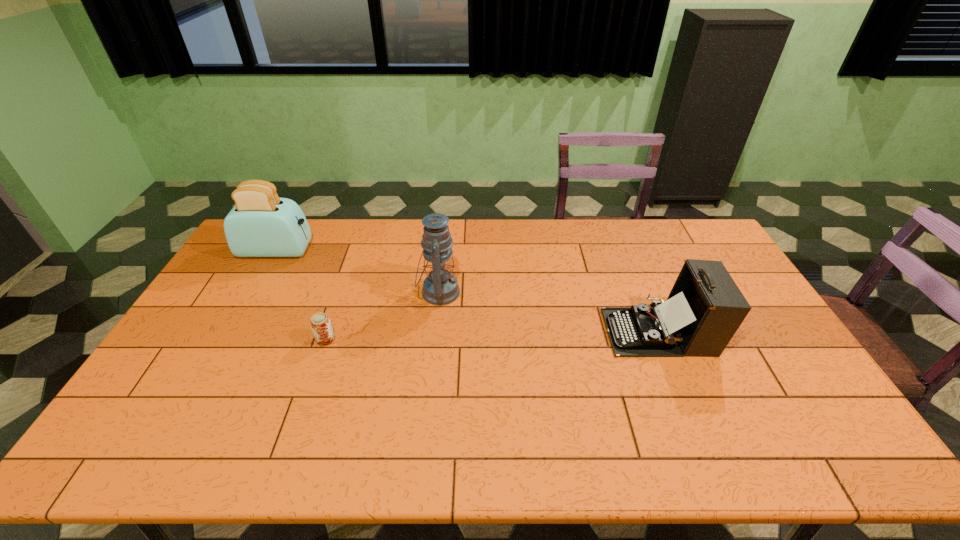
The image size is (960, 540). Identify the location of free spot located 0.260m inside the open case of the rightmost object. (518, 332).

You are a GUI agent. You are given a task and a screenshot of the screen. Output one action in this format:
    pyautogui.click(x=<x>, y=<y>)
    Task: Click on the vacant space situated inside the open case of the rightmost object
    
    Given the screenshot: What is the action you would take?
    tap(569, 332)

The width and height of the screenshot is (960, 540). I want to click on vacant space located 0.060m on the left of the shortest object, so click(x=296, y=339).

Identify the location of object that is at the far edge. This screenshot has width=960, height=540. (261, 224).

Identify the location of object located at the left edge. The width and height of the screenshot is (960, 540). (261, 224).

The height and width of the screenshot is (540, 960). I want to click on object situated at the far left corner, so click(261, 224).

In the image, there is a desktop. What are the coordinates of `free space at the far edge` in the screenshot? It's located at click(391, 255).

Where is `vacant region at the near edge of the desktop`? This screenshot has height=540, width=960. vacant region at the near edge of the desktop is located at coordinates (267, 435).

Identify the location of vacant space at the left edge of the desktop. The height and width of the screenshot is (540, 960). (252, 301).

At what (x,y) coordinates should I click in order to perform the action: click on vacant space at the far right corner of the desktop. Please return your answer as a coordinate pair (x, y). The width and height of the screenshot is (960, 540). Looking at the image, I should click on (679, 240).